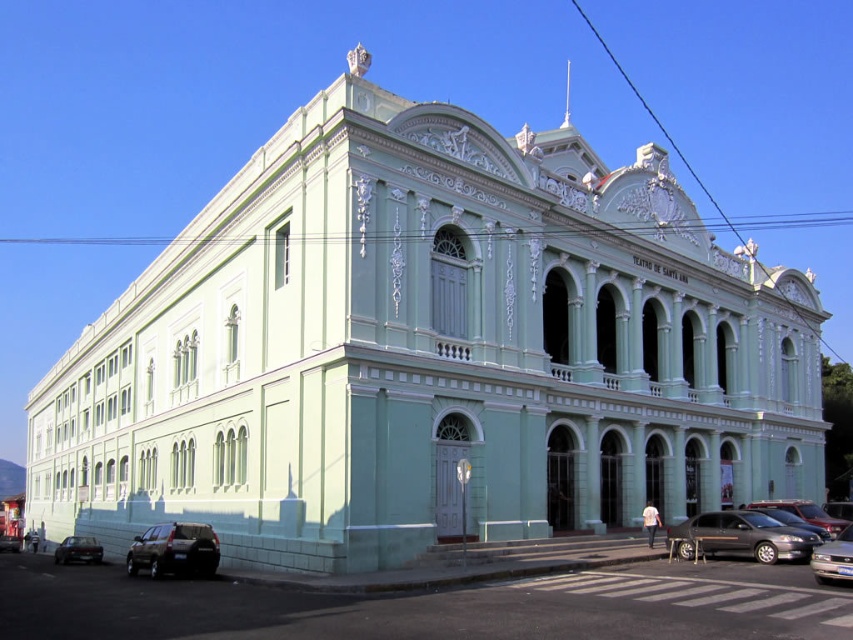
Question: Is silver metallic sedan at lower right further to camera compared to dark gray metallic car at lower left?

Choices:
 (A) yes
 (B) no

Answer: (B)

Question: Can you confirm if dark gray metallic car at lower left is thinner than shiny black car at lower left?

Choices:
 (A) yes
 (B) no

Answer: (B)

Question: Which point is closer to the camera?

Choices:
 (A) pos(828,579)
 (B) pos(3,547)
 (C) pos(738,518)

Answer: (A)

Question: In this image, where is matte black sedan at lower right located relative to shiny black car at lower left?

Choices:
 (A) above
 (B) below

Answer: (A)

Question: Considering the real-world distances, which object is farthest from the dark gray metallic car at lower left?

Choices:
 (A) shiny black car at lower left
 (B) silver metallic sedan at lower right
 (C) shiny black suv at lower left

Answer: (B)

Question: Among these objects, which one is farthest from the camera?

Choices:
 (A) shiny black car at lower left
 (B) shiny black suv at lower left
 (C) matte black sedan at lower right

Answer: (A)